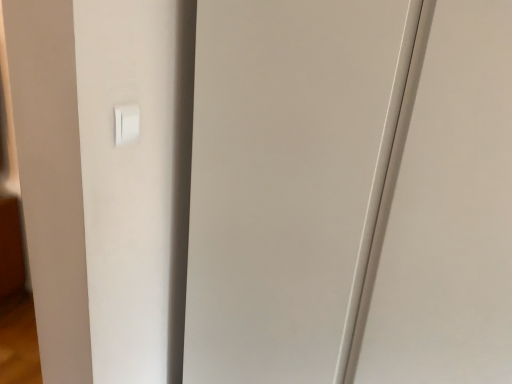
Question: Does point (134, 114) appear closer or farther from the camera than point (386, 94)?

Choices:
 (A) closer
 (B) farther

Answer: (B)

Question: Is white plastic light switch at upper left situated inside transparent glass door at center or outside?

Choices:
 (A) inside
 (B) outside

Answer: (B)

Question: From a real-world perspective, is white plastic light switch at upper left physically located above or below transparent glass door at center?

Choices:
 (A) above
 (B) below

Answer: (A)

Question: Is point (244, 9) positioned closer to the camera than point (115, 132)?

Choices:
 (A) farther
 (B) closer

Answer: (A)

Question: Considering the positions of transparent glass door at center and white plastic light switch at upper left in the image, is transparent glass door at center wider or thinner than white plastic light switch at upper left?

Choices:
 (A) thin
 (B) wide

Answer: (B)

Question: Is transparent glass door at center taller or shorter than white plastic light switch at upper left?

Choices:
 (A) short
 (B) tall

Answer: (B)

Question: Relative to white plastic light switch at upper left, is transparent glass door at center in front or behind?

Choices:
 (A) front
 (B) behind

Answer: (A)